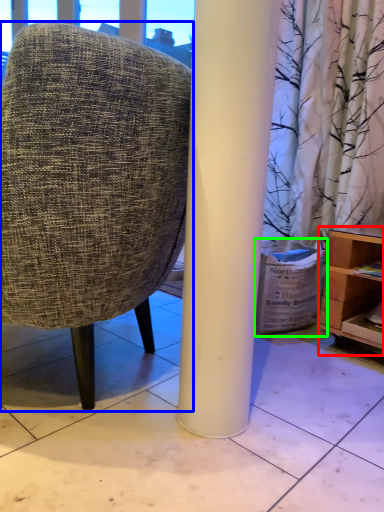
Question: Which object is positioned farthest from shelf (highlighted by a red box)? Select from chair (highlighted by a blue box) and cardboard box (highlighted by a green box).

Choices:
 (A) chair
 (B) cardboard box

Answer: (A)